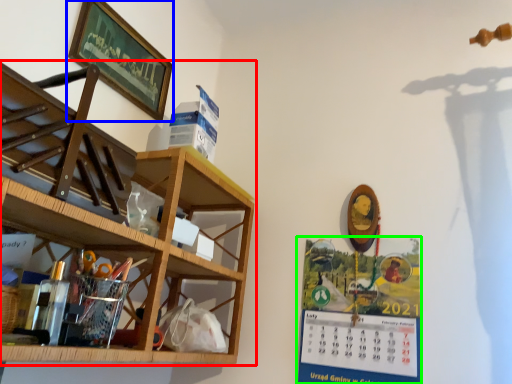
Question: Estimate the real-world distances between objects in this image. Which object is farther from shelf (highlighted by a red box), picture frame (highlighted by a blue box) or poster (highlighted by a green box)?

Choices:
 (A) picture frame
 (B) poster

Answer: (B)